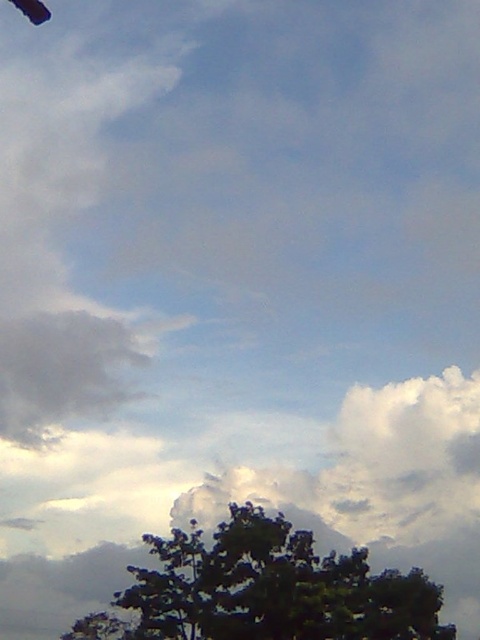
Looking at this image, you are a bird flying in the sky scene described. You want to land somewhere safe. The green leafy tree at lower center and the dark blue fabric parachute at upper left are both visible. Which option is taller and thus safer for landing?

The green leafy tree at lower center is taller than the dark blue fabric parachute at upper left, so it is safer for landing.

You are a bird flying in the sky and want to rest. You see the green leafy tree at lower center and the dark blue fabric parachute at upper left. Which one is bigger and would provide a more comfortable resting spot?

The green leafy tree at lower center is larger than the dark blue fabric parachute at upper left, so it would provide a more comfortable resting spot.

You are standing in the field looking at the green leafy tree at lower center and the dark blue fabric parachute at upper left. Which object is closer to you?

The green leafy tree at lower center is closer to you because it is further to the viewer than the dark blue fabric parachute at upper left.